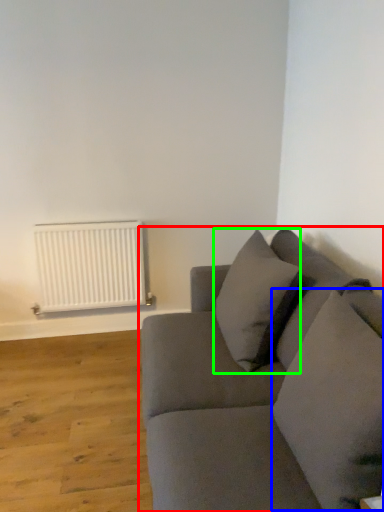
Question: Estimate the real-world distances between objects in this image. Which object is closer to studio couch (highlighted by a red box), pillow (highlighted by a blue box) or pillow (highlighted by a green box)?

Choices:
 (A) pillow
 (B) pillow

Answer: (A)